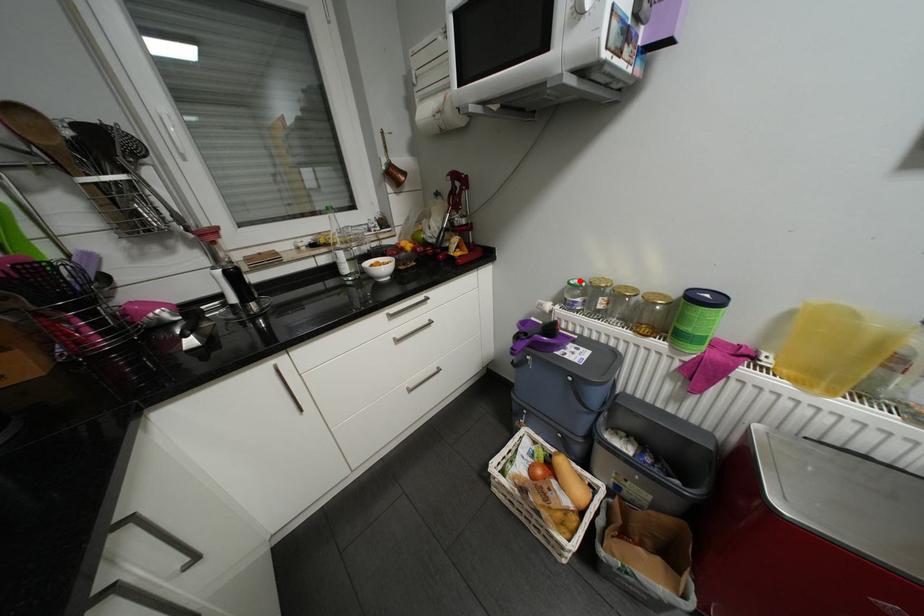
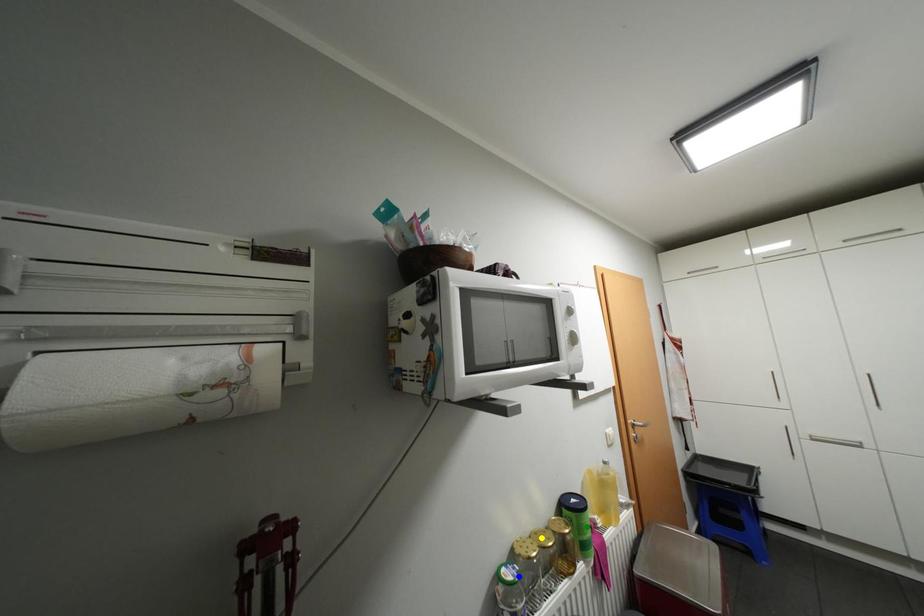
Question: I am providing you with two images of the same scene from different viewpoints. A red point is marked on the first image. You are given multiple points on the second image. Can you choose the point in image 2 that corresponds to the point in image 1?

Choices:
 (A) blue point
 (B) green point
 (C) yellow point

Answer: (A)